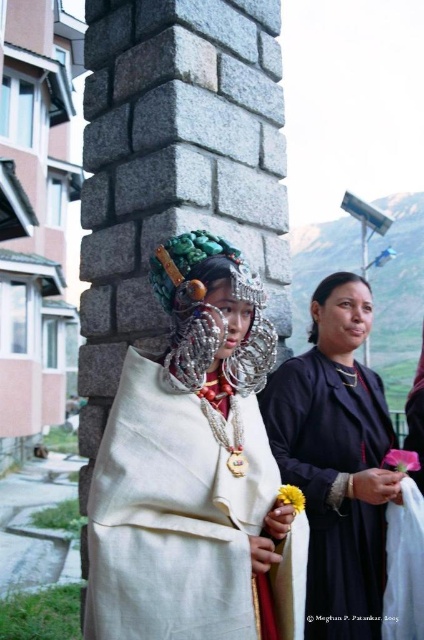
Can you confirm if white fabric at center is positioned to the left of matte black dress at center?

Yes, white fabric at center is to the left of matte black dress at center.

Does white fabric at center have a smaller size compared to matte black dress at center?

Yes.

Image resolution: width=424 pixels, height=640 pixels. Describe the element at coordinates (195, 472) in the screenshot. I see `white fabric at center` at that location.

Find the location of a particular element. white fabric at center is located at coordinates (195, 472).

Is white fabric at center thinner than silver metallic headdress at center?

Incorrect, white fabric at center's width is not less than silver metallic headdress at center's.

Can you confirm if white fabric at center is shorter than silver metallic headdress at center?

No, white fabric at center is not shorter than silver metallic headdress at center.

Does point (203, 262) come behind point (186, 234)?

That is False.

I want to click on white fabric at center, so click(x=195, y=472).

From the picture: Which is more to the left, matte black dress at center or silver metallic headdress at center?

silver metallic headdress at center is more to the left.

Is point (301, 387) positioned after point (262, 371)?

Yes.

Locate an element on the screen. The width and height of the screenshot is (424, 640). matte black dress at center is located at coordinates (337, 460).